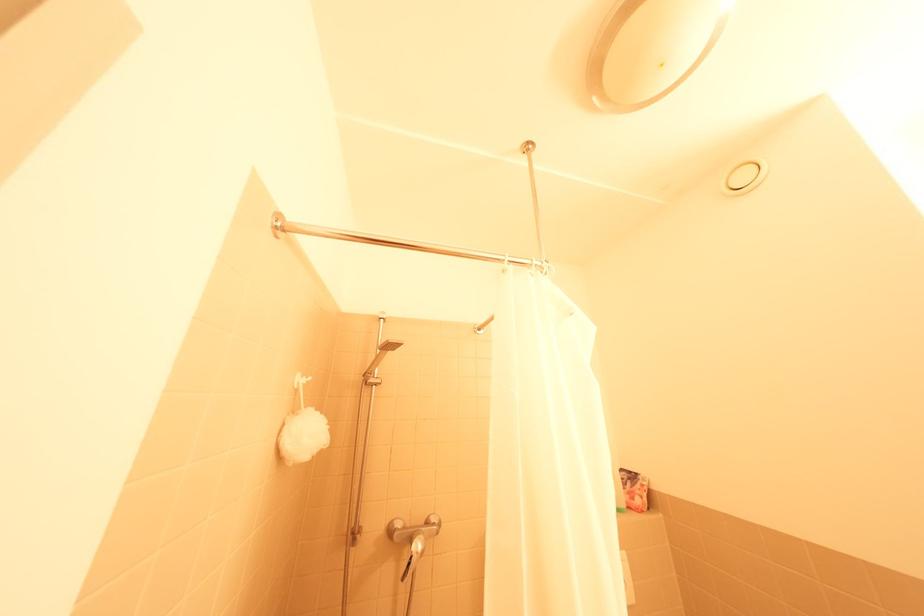
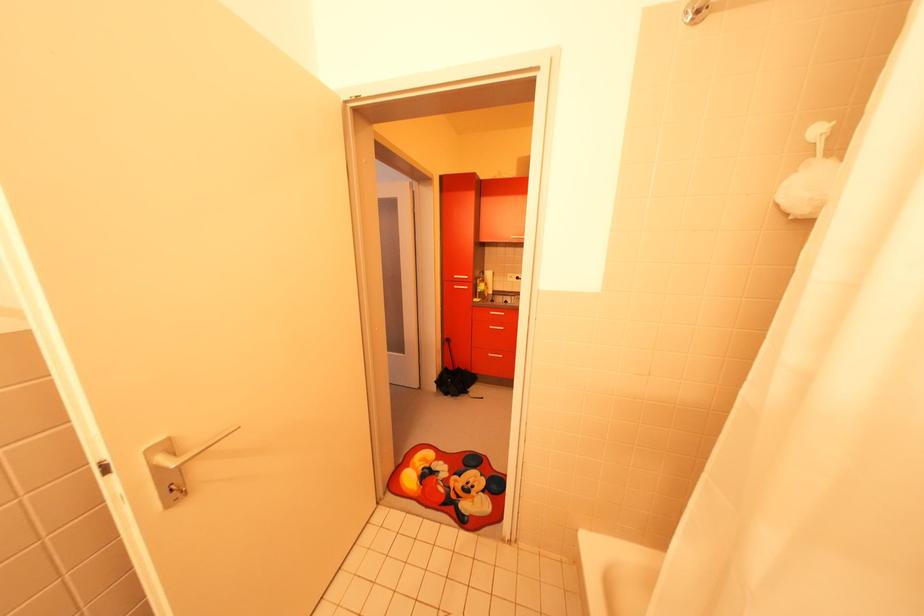
The point at [286,229] is marked in the first image. Where is the corresponding point in the second image?

(702, 20)